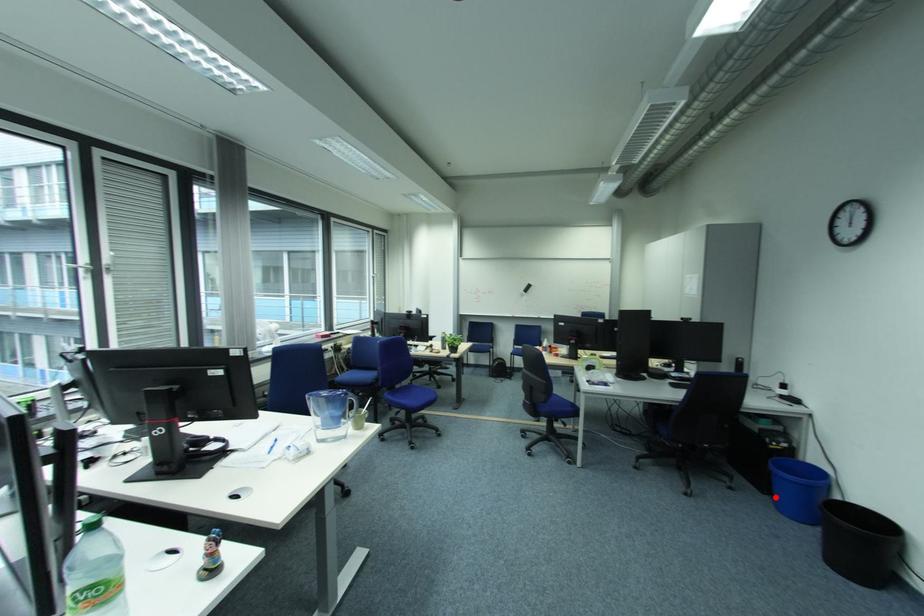
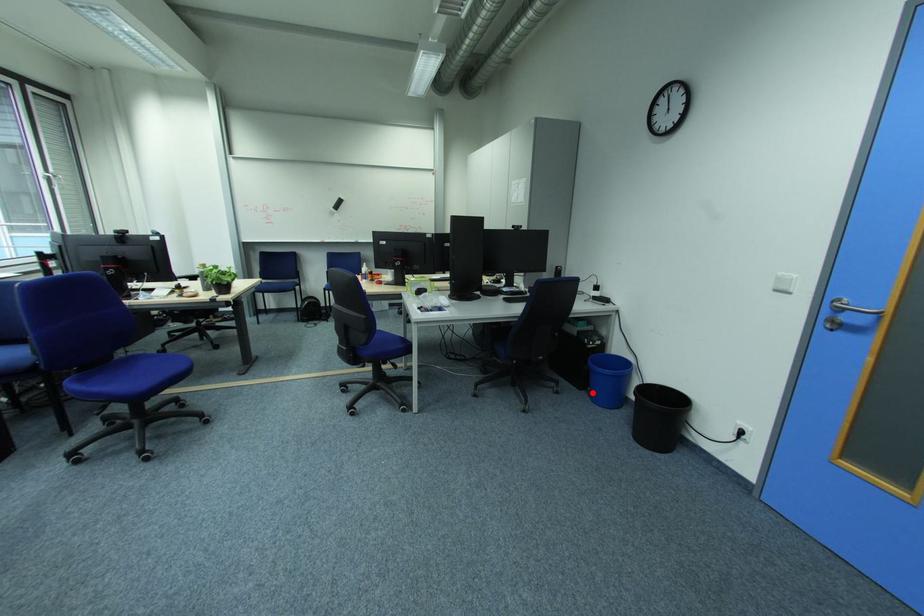
I am providing you with two images of the same scene from different viewpoints. A red point is marked on the first image and another point is marked on the second image. Is the red point in image1 aligned with the point shown in image2?

Yes